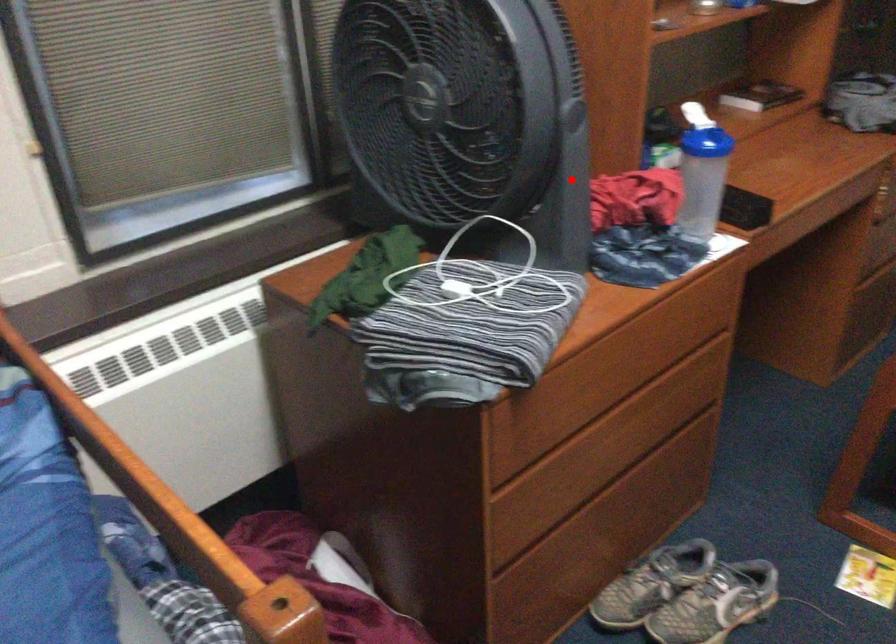
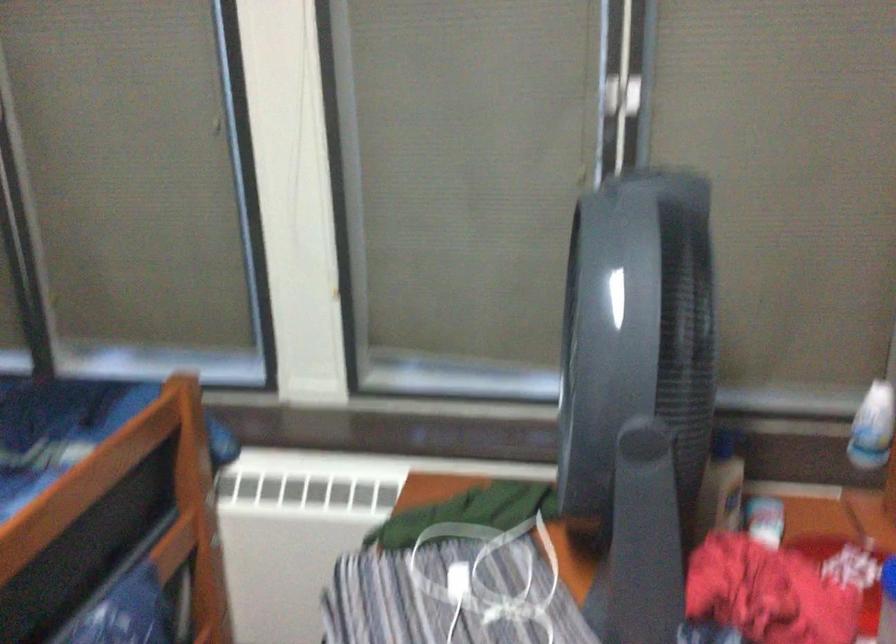
In the second image, find the point that corresponds to the highlighted location in the first image.

(645, 521)